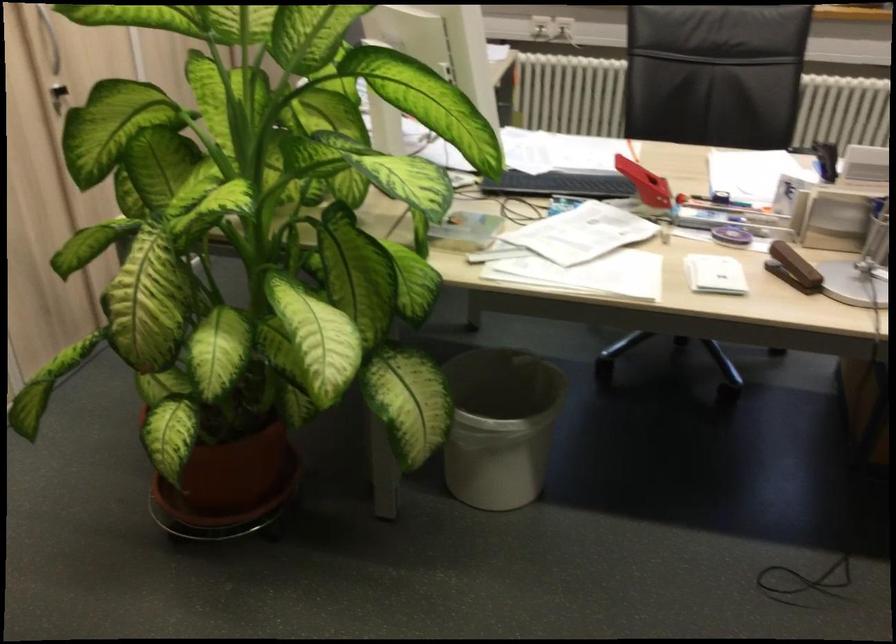
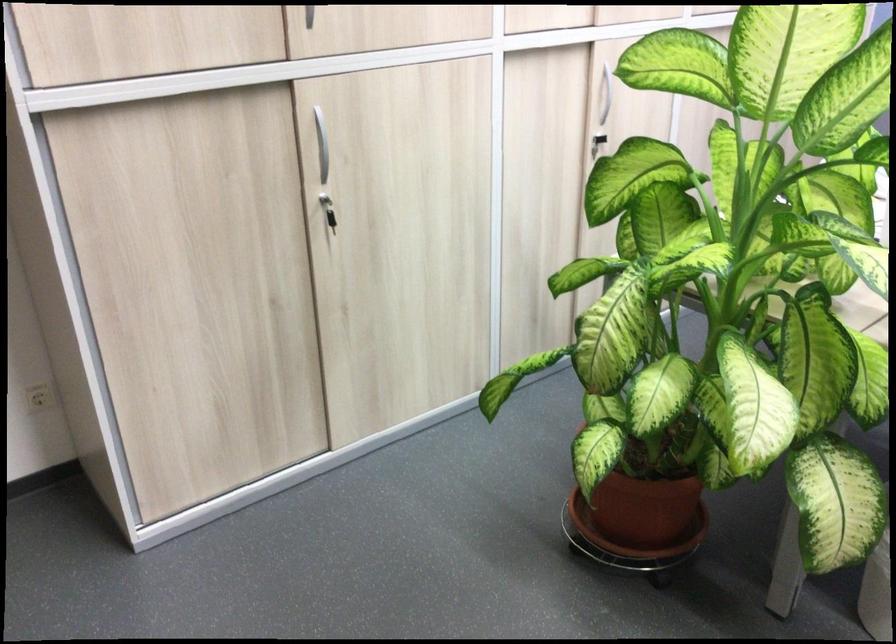
In the second image, find the point that corresponds to [245,476] in the first image.

(643, 509)